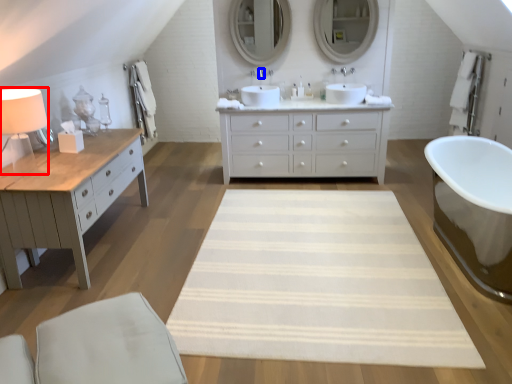
Question: Which of the following is the closest to the observer, table lamp (highlighted by a red box) or faucet (highlighted by a blue box)?

Choices:
 (A) table lamp
 (B) faucet

Answer: (A)